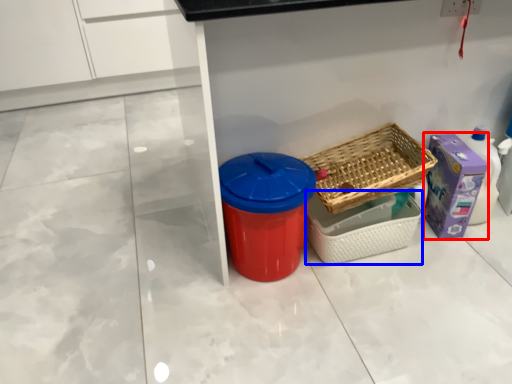
Question: Which object appears farthest to the camera in this image, storage box (highlighted by a red box) or basket (highlighted by a blue box)?

Choices:
 (A) storage box
 (B) basket

Answer: (A)